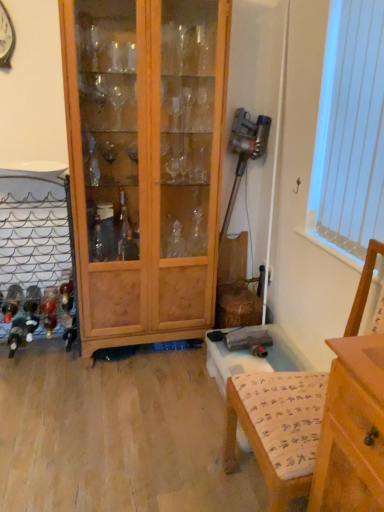
Image resolution: width=384 pixels, height=512 pixels. I want to click on vacant area that is in front of wooden cabinet at center, so click(x=135, y=397).